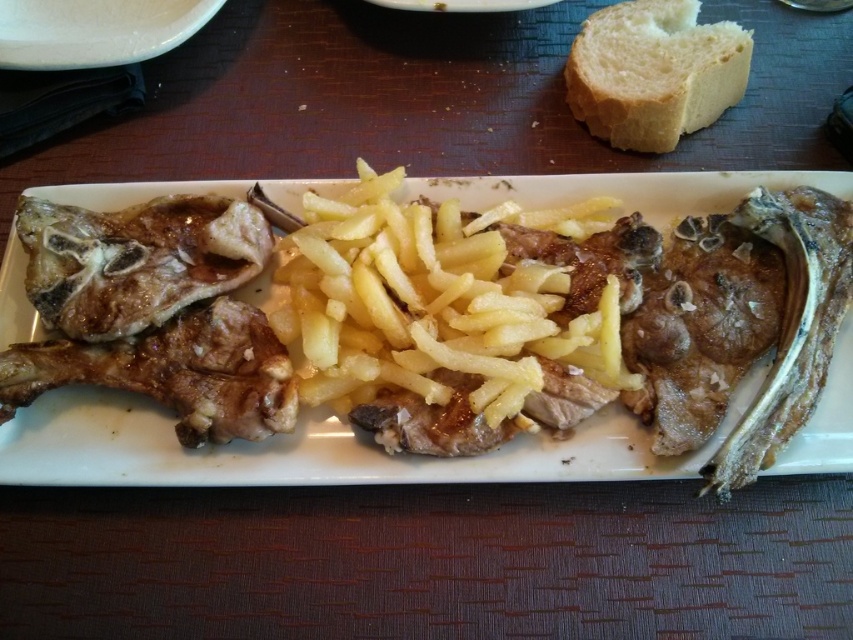
Locate an element on the screen. The width and height of the screenshot is (853, 640). golden brown crispy fries at center is located at coordinates (306, 451).

Is golden brown crispy fries at center wider than white soft bread at upper right?

Yes.

Measure the distance between point (x=570, y=195) and camera.

Point (x=570, y=195) is 4.32 feet from camera.

Identify the location of golden brown crispy fries at center. This screenshot has height=640, width=853. (306, 451).